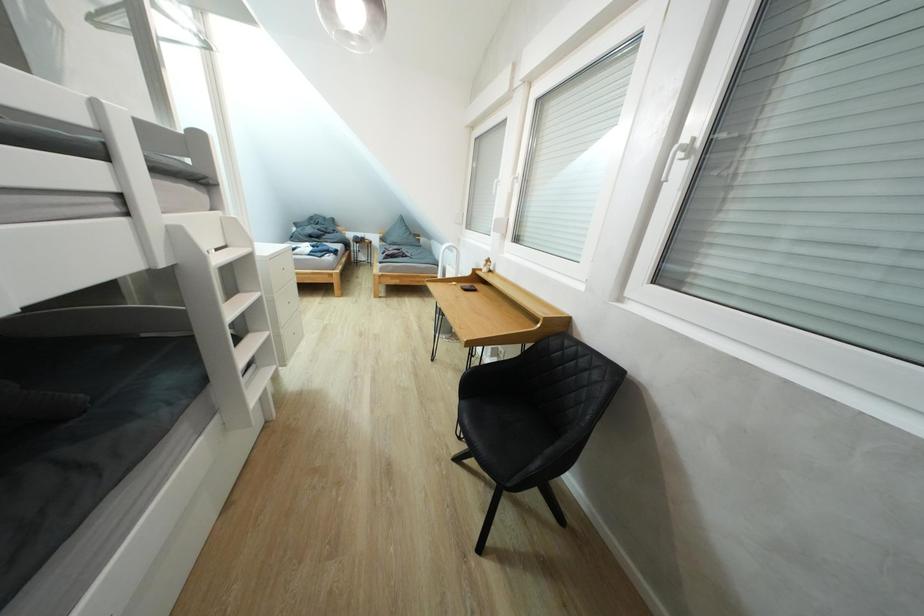
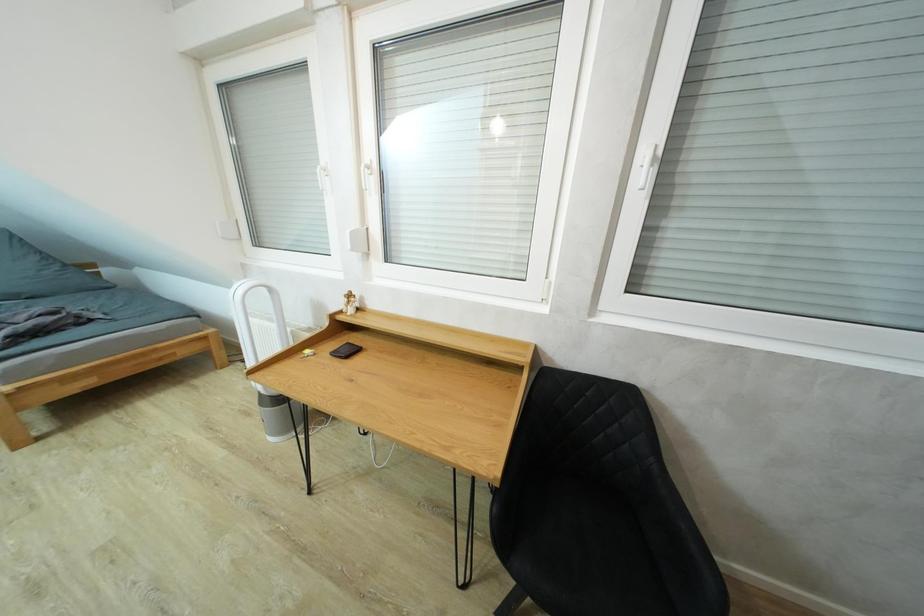
Question: The first image is from the beginning of the video and the second image is from the end. How did the camera likely rotate when shooting the video?

Choices:
 (A) Left
 (B) Right
 (C) Up
 (D) Down

Answer: (B)